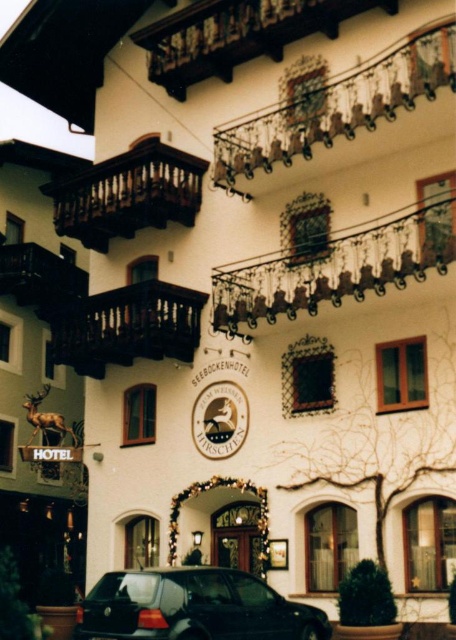
From the picture: You are standing in front of the Seebockenhotel. Where exactly is the dark brown wood balcony at center left located?

The dark brown wood balcony at center left is located at point (x=128, y=326).

You are a hotel guest staying at the Seeboeckenhotel and need to move from your balcony, the brown wooden balcony at upper center, to the wooden balcony at left to retrieve a package. Can you safely walk between the two balconies without any equipment?

The brown wooden balcony at upper center and wooden balcony at left are 12.32 meters apart from each other, which is a significant distance. Walking between them without any equipment would be unsafe due to the large gap.

You are standing at the entrance of the Seeboeckenhotel and want to locate the brown wooden balcony at upper center. According to the coordinates provided, where exactly is it positioned?

The brown wooden balcony at upper center is positioned at coordinates point (128, 193).